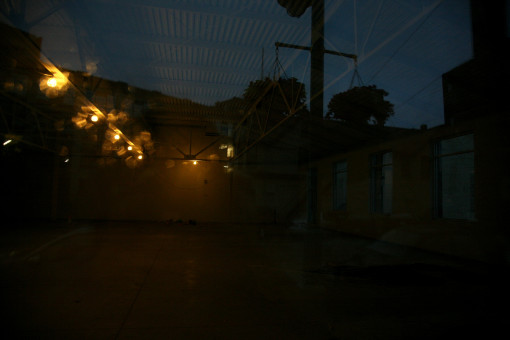
Find the location of `small white door`. small white door is located at coordinates (386, 190).